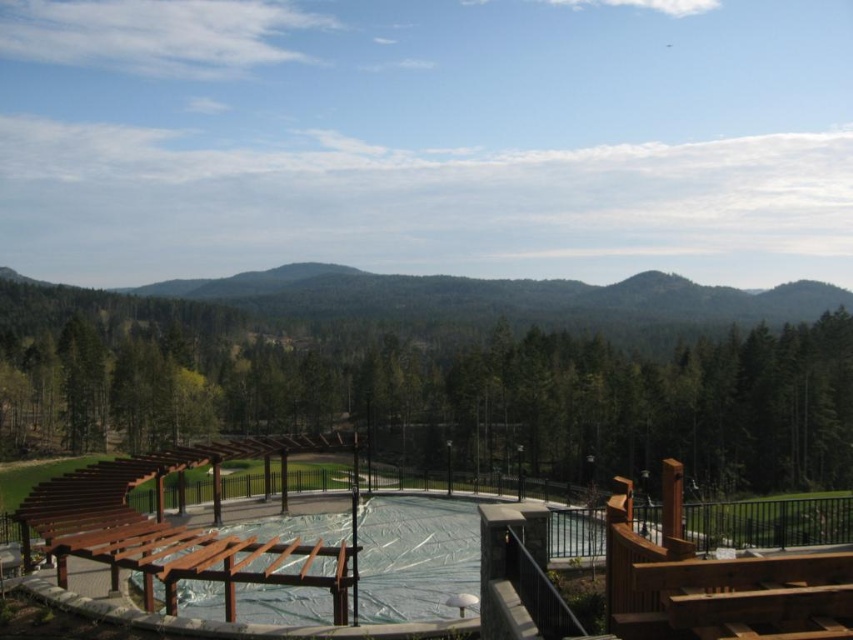
You are standing on the brown wooden deck at center and want to take a photo of the green wood trees at center. Will the trees be fully visible in your photo if you stand at the edge of the deck?

The green wood trees at center are taller than the brown wooden deck at center, so yes, the trees will be fully visible in your photo when standing at the edge of the deck.

Based on the provided scene description, where is the green wood trees at center located in terms of their 2D coordinates?

The green wood trees at center are located at the 2D coordinates of point [450,376].

What is located at the coordinates point (450, 376) in the image?

The point (450, 376) corresponds to green wood trees at center.